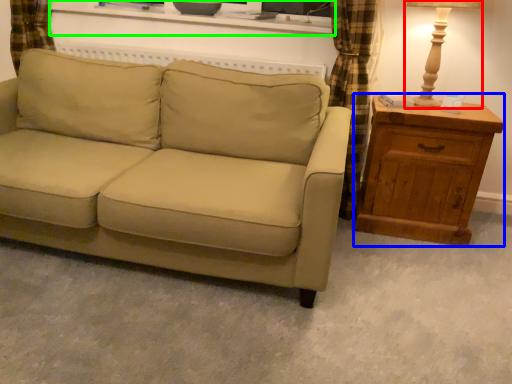
Question: Which object is positioned farthest from table lamp (highlighted by a red box)? Select from chest of drawers (highlighted by a blue box) and entertainment center (highlighted by a green box).

Choices:
 (A) chest of drawers
 (B) entertainment center

Answer: (B)